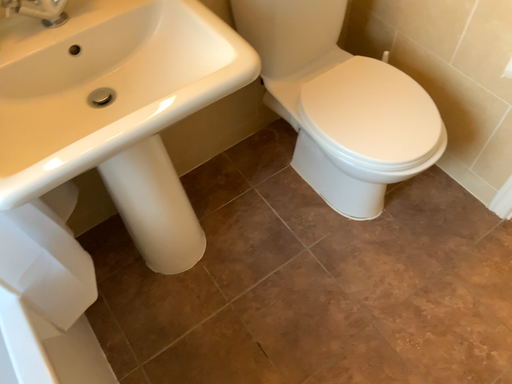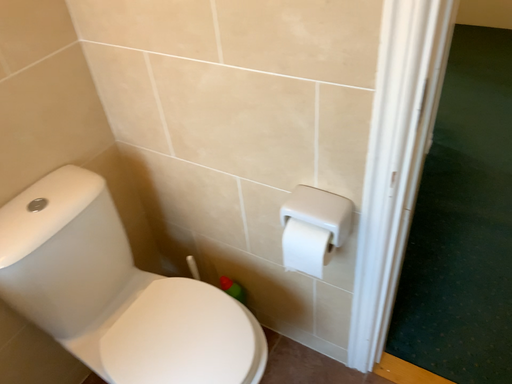
Question: Which way did the camera rotate in the video?

Choices:
 (A) rotated left
 (B) rotated right

Answer: (B)